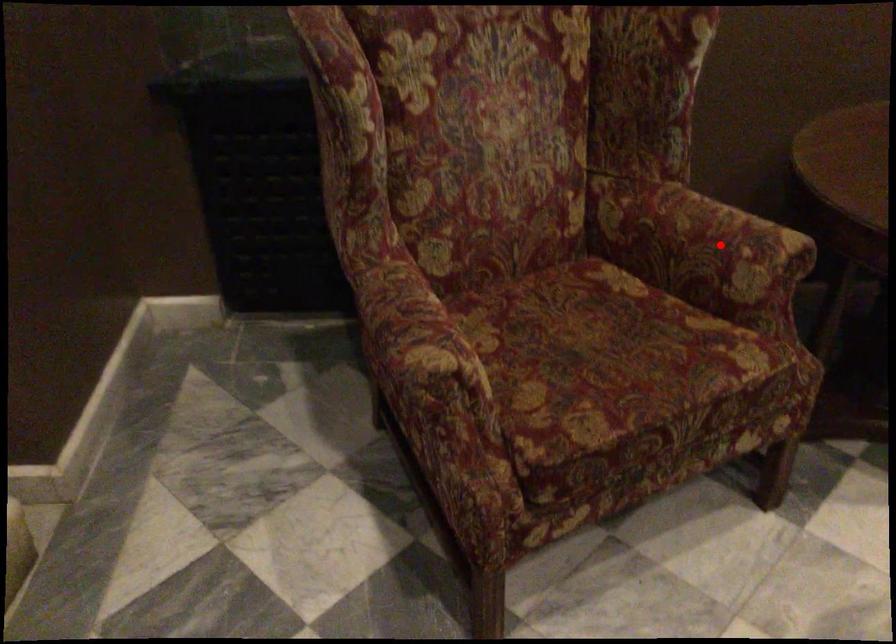
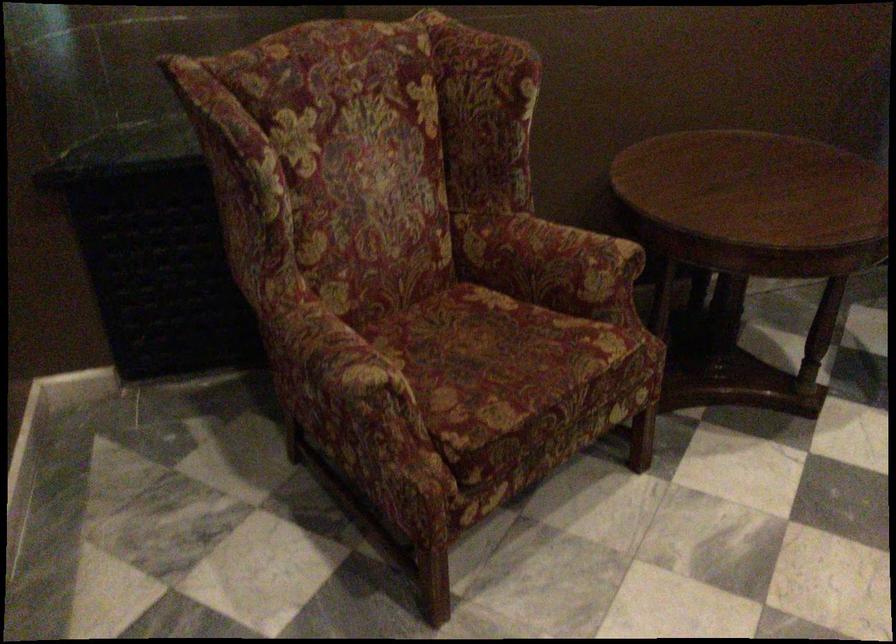
Question: I am providing you with two images of the same scene from different viewpoints. Given a red point in image1, look at the same physical point in image2. Is it:

Choices:
 (A) Closer to the viewpoint
 (B) Farther from the viewpoint

Answer: (B)